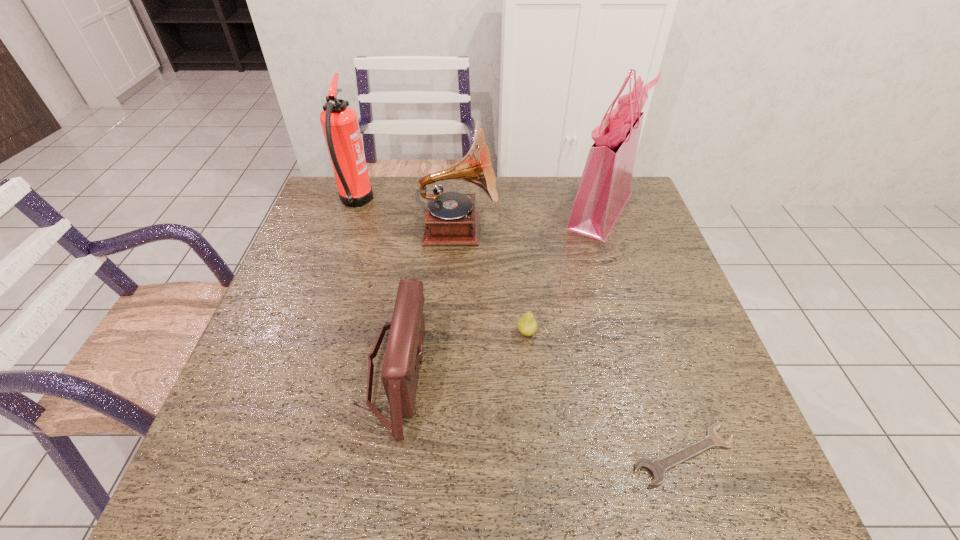
This screenshot has width=960, height=540. Find the location of `free location that satisfies the following two spatial constraints: 1. at the nozzle of the fire extinguisher; 2. on the right side of the pear`. free location that satisfies the following two spatial constraints: 1. at the nozzle of the fire extinguisher; 2. on the right side of the pear is located at coordinates (311, 333).

Where is `free space that satisfies the following two spatial constraints: 1. on the horn of the third object from right to left; 2. on the right side of the phonograph_record`? Image resolution: width=960 pixels, height=540 pixels. free space that satisfies the following two spatial constraints: 1. on the horn of the third object from right to left; 2. on the right side of the phonograph_record is located at coordinates (452, 333).

The height and width of the screenshot is (540, 960). Identify the location of vacant position in the image that satisfies the following two spatial constraints: 1. on the horn of the second shortest object; 2. on the right side of the phonograph_record. (452, 333).

This screenshot has width=960, height=540. In order to click on free point that satisfies the following two spatial constraints: 1. on the horn of the phonograph_record; 2. on the back side of the shortest object in this screenshot , I will do `click(445, 455)`.